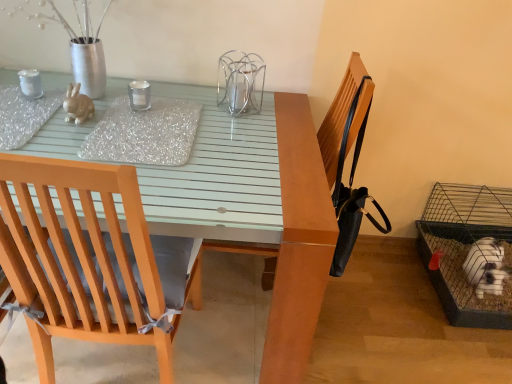
Identify the location of vacant space in front of clear glass candle holder at center, which is the second bird cage in back-to-front order. This screenshot has width=512, height=384. (240, 130).